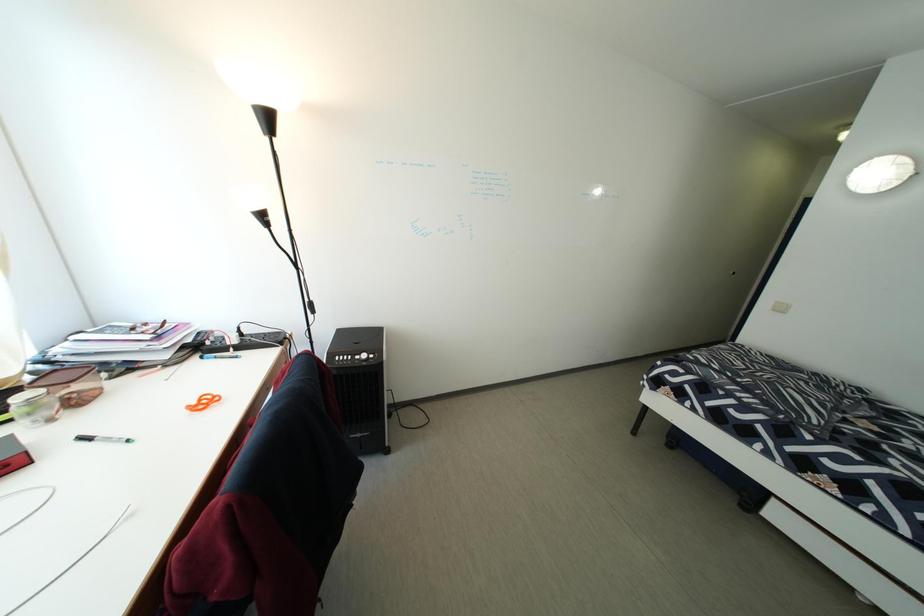
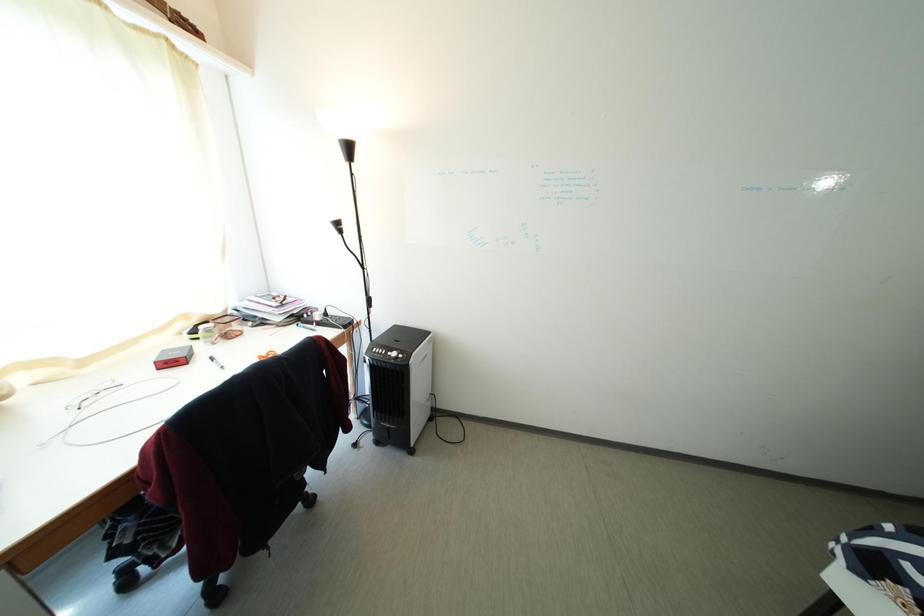
Question: How did the camera likely rotate?

Choices:
 (A) Left
 (B) Right
 (C) Up
 (D) Down

Answer: (A)